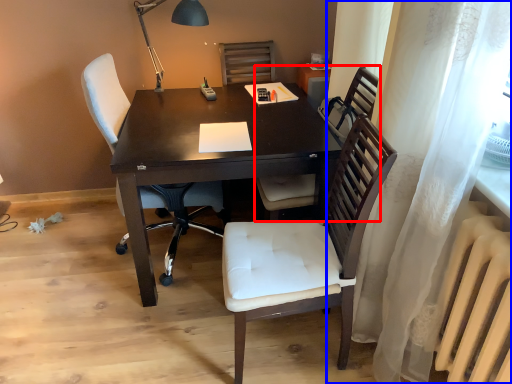
Question: Among these objects, which one is farthest to the camera, chair (highlighted by a red box) or curtain (highlighted by a blue box)?

Choices:
 (A) chair
 (B) curtain

Answer: (A)